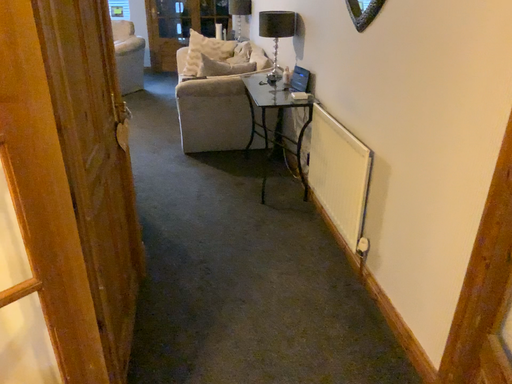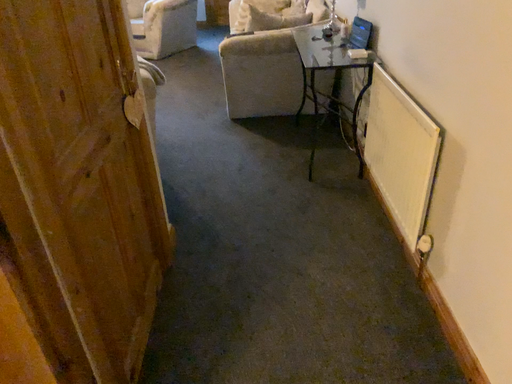
Question: How did the camera likely rotate when shooting the video?

Choices:
 (A) rotated left
 (B) rotated right

Answer: (A)